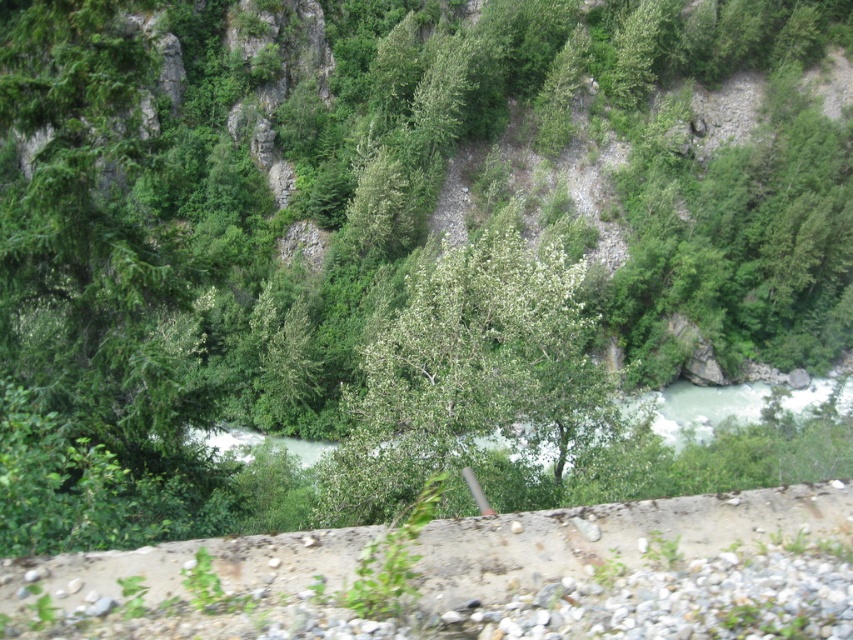
You are standing at the center of the scene and want to walk towards the river. Which tree, the green matte tree at left or the green leafy tree at center, should you pass by first?

You should pass by the green matte tree at left first because it is located to the left of the green leafy tree at center, meaning it is closer to your starting position when facing the river.

You are a hiker who wants to take a photo of both the green matte tree at left and the green leafy tree at center. Since you have a camera with a fixed focal length, you need to know which tree is wider to frame your shot properly. Can you tell me which tree has a greater width?

The green matte tree at left has a larger width than the green leafy tree at center according to the description.

From the picture: You are standing at the point labeled point (x=453, y=291) and want to move to the point labeled point (x=41, y=317). Which direction should you walk to get closer to your destination?

You should walk towards the point labeled point (x=41, y=317) because it is closer to the viewer than the point labeled point (x=453, y=291). Moving towards the viewer would bring you closer to your destination.